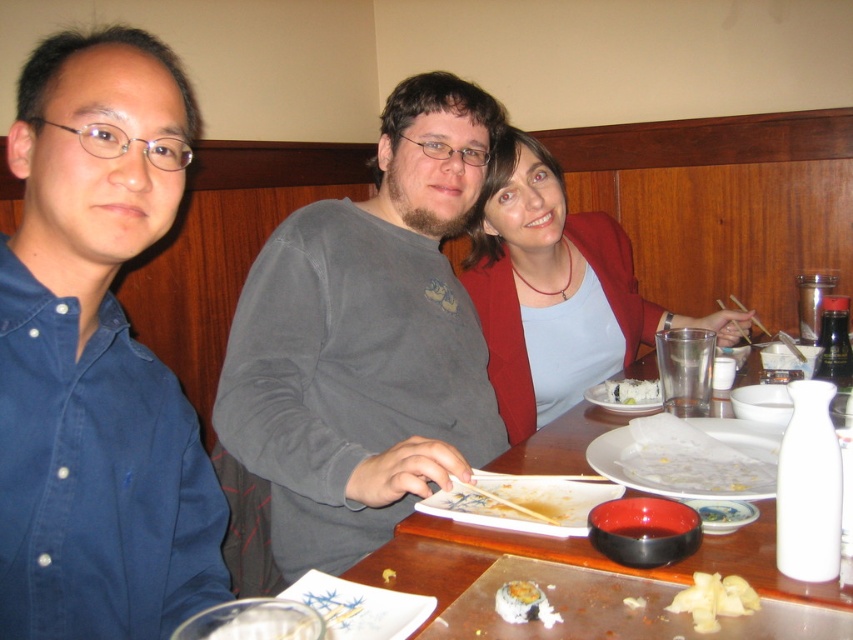
Question: Does blue denim shirt at left have a smaller size compared to shiny white sushi at center?

Choices:
 (A) no
 (B) yes

Answer: (A)

Question: Which object is closer to the camera taking this photo?

Choices:
 (A) wooden table at center
 (B) white soft potato at lower center
 (C) light blue fabric shirt at center

Answer: (B)

Question: Which of these objects is positioned closest to the blue denim shirt at left?

Choices:
 (A) matte ceramic bowl at center
 (B) transparent paper plate at center

Answer: (B)

Question: In this image, where is gray cotton shirt at center located relative to white glossy plate at center?

Choices:
 (A) below
 (B) above

Answer: (B)

Question: Among these points, which one is nearest to the camera?

Choices:
 (A) (712, 586)
 (B) (495, 529)
 (C) (721, 451)
 (D) (236, 392)

Answer: (A)

Question: Can you confirm if transparent paper plate at center is thinner than white glossy plate at center?

Choices:
 (A) no
 (B) yes

Answer: (A)